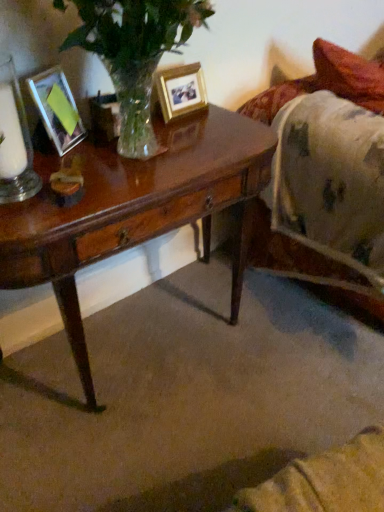
Question: Can you confirm if white wax candle at left is positioned to the left of clear glass candle holder at left?

Choices:
 (A) yes
 (B) no

Answer: (A)

Question: From the image's perspective, would you say white wax candle at left is shown under clear glass candle holder at left?

Choices:
 (A) no
 (B) yes

Answer: (A)

Question: Are white wax candle at left and clear glass candle holder at left making contact?

Choices:
 (A) yes
 (B) no

Answer: (A)

Question: Are white wax candle at left and clear glass candle holder at left far apart?

Choices:
 (A) yes
 (B) no

Answer: (B)

Question: Does white wax candle at left have a larger size compared to clear glass candle holder at left?

Choices:
 (A) no
 (B) yes

Answer: (B)

Question: Is white wax candle at left positioned behind clear glass candle holder at left?

Choices:
 (A) no
 (B) yes

Answer: (B)

Question: Can you confirm if shiny brown wood desk at center is taller than matte glass picture frame at left, marked as the first picture frame in a front-to-back arrangement?

Choices:
 (A) yes
 (B) no

Answer: (A)

Question: Can you confirm if shiny brown wood desk at center is bigger than matte glass picture frame at left, which is the first picture frame in left-to-right order?

Choices:
 (A) yes
 (B) no

Answer: (A)

Question: Considering the relative sizes of shiny brown wood desk at center and matte glass picture frame at left, which is the first picture frame in left-to-right order, in the image provided, is shiny brown wood desk at center wider than matte glass picture frame at left, which is the first picture frame in left-to-right order,?

Choices:
 (A) yes
 (B) no

Answer: (A)

Question: From the image's perspective, is shiny brown wood desk at center under matte glass picture frame at left, acting as the second picture frame starting from the back?

Choices:
 (A) no
 (B) yes

Answer: (B)

Question: Can matte glass picture frame at left, the second picture frame positioned from the right, be found inside shiny brown wood desk at center?

Choices:
 (A) yes
 (B) no

Answer: (B)

Question: Considering the relative positions of shiny brown wood desk at center and matte glass picture frame at left, marked as the first picture frame in a front-to-back arrangement, in the image provided, is shiny brown wood desk at center behind matte glass picture frame at left, marked as the first picture frame in a front-to-back arrangement,?

Choices:
 (A) no
 (B) yes

Answer: (A)

Question: Considering the relative positions of fluffy white blanket at right and clear glass candle holder at left in the image provided, is fluffy white blanket at right behind clear glass candle holder at left?

Choices:
 (A) yes
 (B) no

Answer: (A)